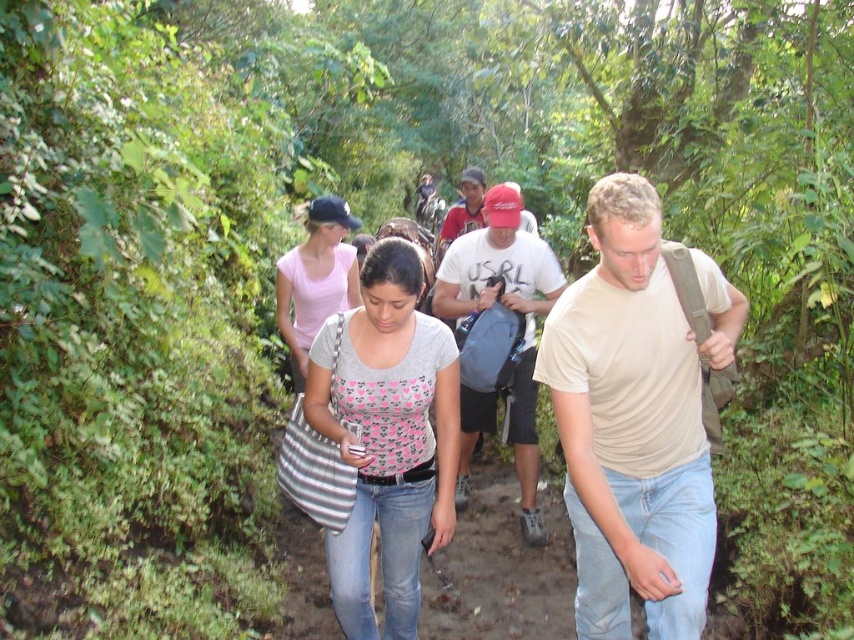
Does beige cotton shirt at center have a larger size compared to gray printed shirt at center?

Indeed, beige cotton shirt at center has a larger size compared to gray printed shirt at center.

Locate an element on the screen. beige cotton shirt at center is located at coordinates (636, 419).

In order to click on beige cotton shirt at center in this screenshot , I will do `click(636, 419)`.

Is point (726, 298) positioned after point (309, 260)?

No, (726, 298) is in front of (309, 260).

Between beige cotton shirt at center and pink cotton shirt at center, which one is positioned higher?

pink cotton shirt at center is higher up.

This screenshot has height=640, width=854. I want to click on beige cotton shirt at center, so click(x=636, y=419).

Locate an element on the screen. This screenshot has height=640, width=854. beige cotton shirt at center is located at coordinates (636, 419).

Can you confirm if gray printed shirt at center is taller than pink cotton shirt at center?

Indeed, gray printed shirt at center has a greater height compared to pink cotton shirt at center.

Which is more to the right, gray printed shirt at center or pink cotton shirt at center?

gray printed shirt at center

Which is behind, point (351, 365) or point (288, 292)?

The point (288, 292) is more distant.

The height and width of the screenshot is (640, 854). I want to click on gray printed shirt at center, so click(387, 436).